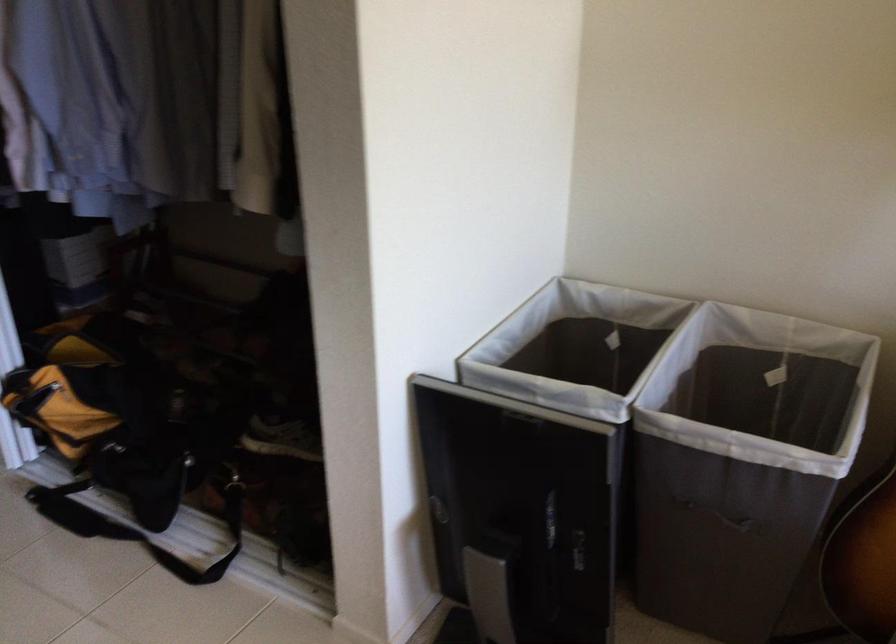
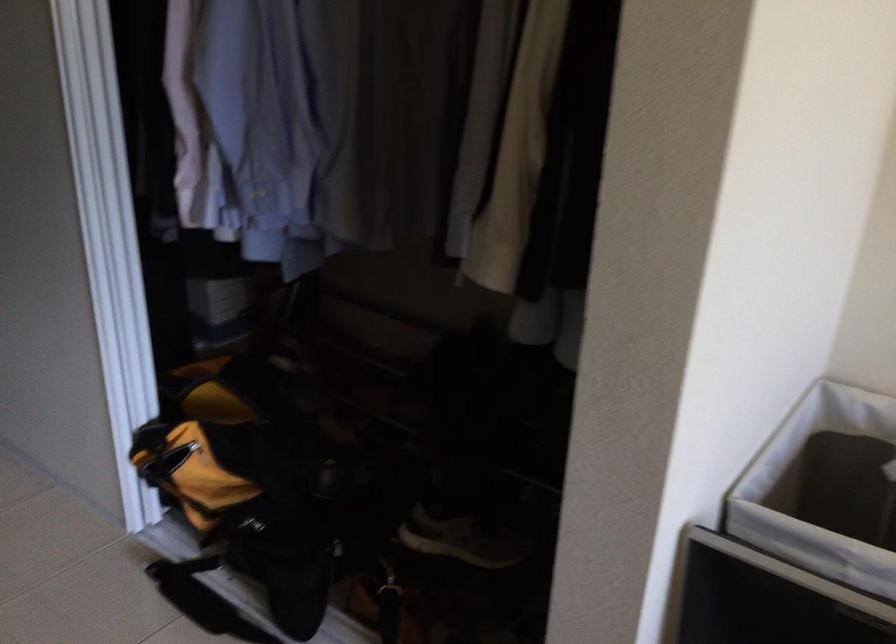
Question: The first image is from the beginning of the video and the second image is from the end. How did the camera likely rotate when shooting the video?

Choices:
 (A) Left
 (B) Right
 (C) Up
 (D) Down

Answer: (A)